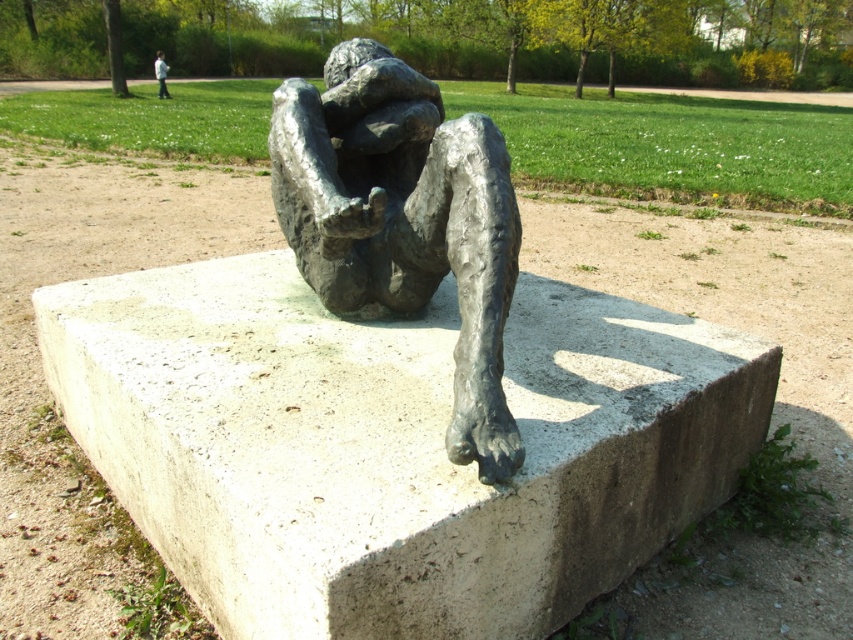
Based on the photo, you are an art curator planning to install a new sculpture in the park. You notice the smooth concrete base at center and the white cotton shirt at upper center in the existing sculpture. Which object is positioned lower in the scene?

The smooth concrete base at center is positioned below the white cotton shirt at upper center, so the smooth concrete base at center is lower in the scene.

You are standing in front of the sculpture and want to touch both the smooth concrete base at center and the white cotton shirt at upper center. Which object will require you to reach further away from your body?

The white cotton shirt at upper center requires reaching further away from your body because it is positioned farther from the viewer than the smooth concrete base at center.